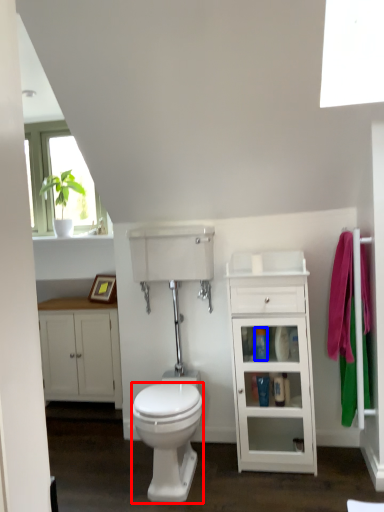
Question: Which object appears closest to the camera in this image, bidet (highlighted by a red box) or toiletry (highlighted by a blue box)?

Choices:
 (A) bidet
 (B) toiletry

Answer: (A)